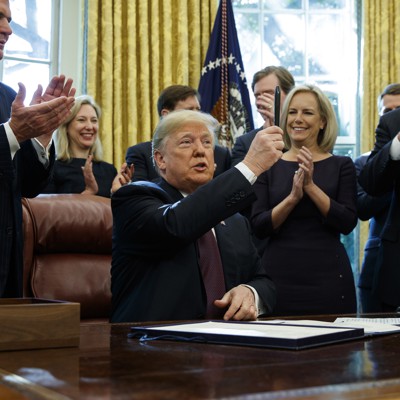
Identify the location of curtain. This screenshot has height=400, width=400. (147, 67), (370, 102).